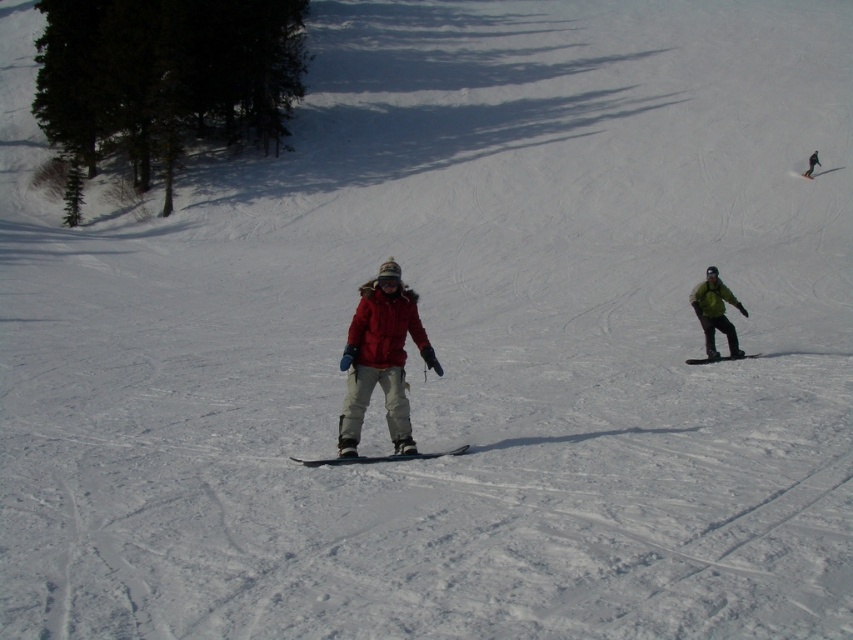
Is green matte snowboarder at right below matte black snowboard at right?

Incorrect, green matte snowboarder at right is not positioned below matte black snowboard at right.

At what (x,y) coordinates should I click in order to perform the action: click on green matte snowboarder at right. Please return your answer as a coordinate pair (x, y). Looking at the image, I should click on (715, 312).

Between matte black snowboard at right and black matte snowboard at upper right, which one appears on the left side from the viewer's perspective?

From the viewer's perspective, matte black snowboard at right appears more on the left side.

Which is in front, point (743, 353) or point (801, 176)?

Positioned in front is point (743, 353).

This screenshot has height=640, width=853. Identify the location of matte black snowboard at right. (718, 358).

Can you confirm if matte red jacket at center is shorter than black matte snowboard at upper right?

In fact, matte red jacket at center may be taller than black matte snowboard at upper right.

Describe the element at coordinates (381, 358) in the screenshot. I see `matte red jacket at center` at that location.

You are a GUI agent. You are given a task and a screenshot of the screen. Output one action in this format:
    pyautogui.click(x=<x>, y=<y>)
    Task: Click on the matte red jacket at center
    Image resolution: width=853 pixels, height=640 pixels.
    Given the screenshot: What is the action you would take?
    pyautogui.click(x=381, y=358)